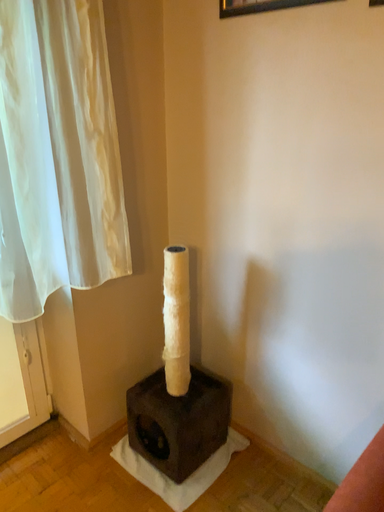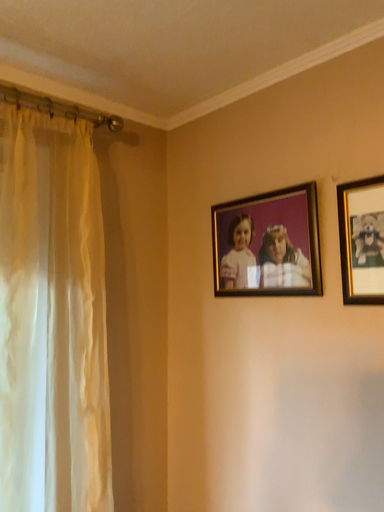
Question: Which way did the camera rotate in the video?

Choices:
 (A) rotated downward
 (B) rotated upward

Answer: (B)